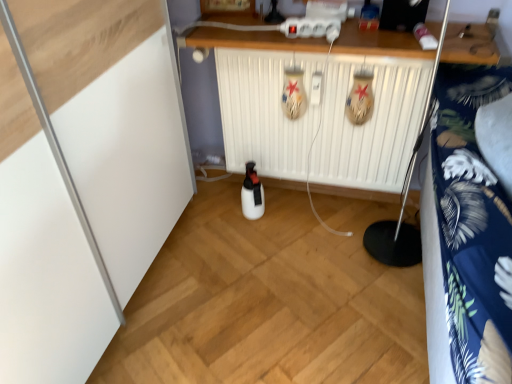
Question: Can you see white plastic radiator at center touching white wood counter at upper center?

Choices:
 (A) yes
 (B) no

Answer: (B)

Question: Is white plastic radiator at center far from white wood counter at upper center?

Choices:
 (A) no
 (B) yes

Answer: (A)

Question: Is white plastic radiator at center oriented towards white wood counter at upper center?

Choices:
 (A) no
 (B) yes

Answer: (A)

Question: Can you confirm if white plastic radiator at center is bigger than white wood counter at upper center?

Choices:
 (A) no
 (B) yes

Answer: (B)

Question: Is white wood counter at upper center at the back of white plastic radiator at center?

Choices:
 (A) no
 (B) yes

Answer: (A)

Question: Does white plastic radiator at center lie behind white wood counter at upper center?

Choices:
 (A) no
 (B) yes

Answer: (B)

Question: Is blue floral fabric at right surrounding white wood counter at upper center?

Choices:
 (A) no
 (B) yes

Answer: (A)

Question: From a real-world perspective, is blue floral fabric at right over white wood counter at upper center?

Choices:
 (A) yes
 (B) no

Answer: (B)

Question: Is blue floral fabric at right behind white wood counter at upper center?

Choices:
 (A) yes
 (B) no

Answer: (B)

Question: Is the depth of blue floral fabric at right less than that of white wood counter at upper center?

Choices:
 (A) yes
 (B) no

Answer: (A)

Question: Does blue floral fabric at right have a lesser height compared to white wood counter at upper center?

Choices:
 (A) no
 (B) yes

Answer: (A)

Question: Is blue floral fabric at right oriented away from white wood counter at upper center?

Choices:
 (A) yes
 (B) no

Answer: (A)

Question: From the image's perspective, is white plastic radiator at center on top of blue floral fabric at right?

Choices:
 (A) yes
 (B) no

Answer: (A)